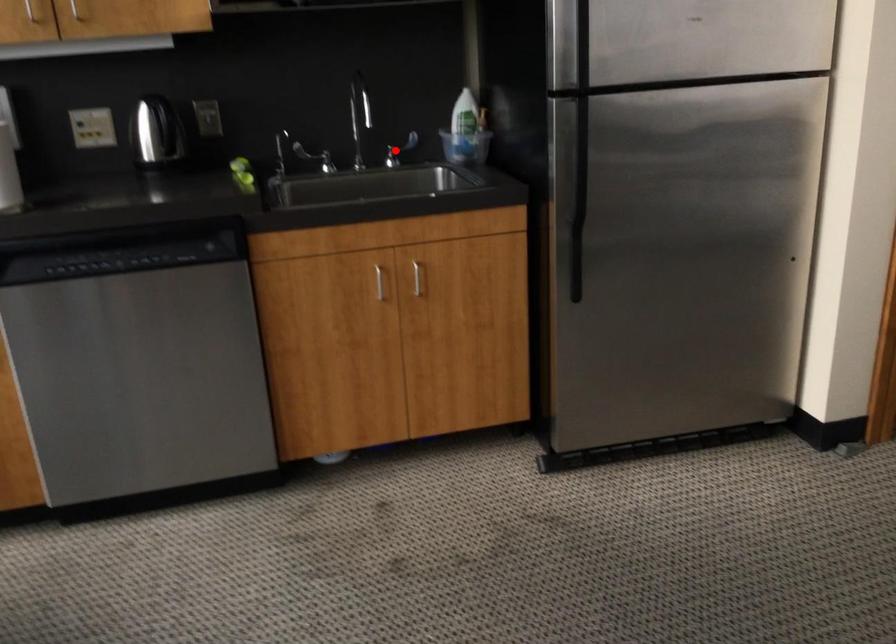
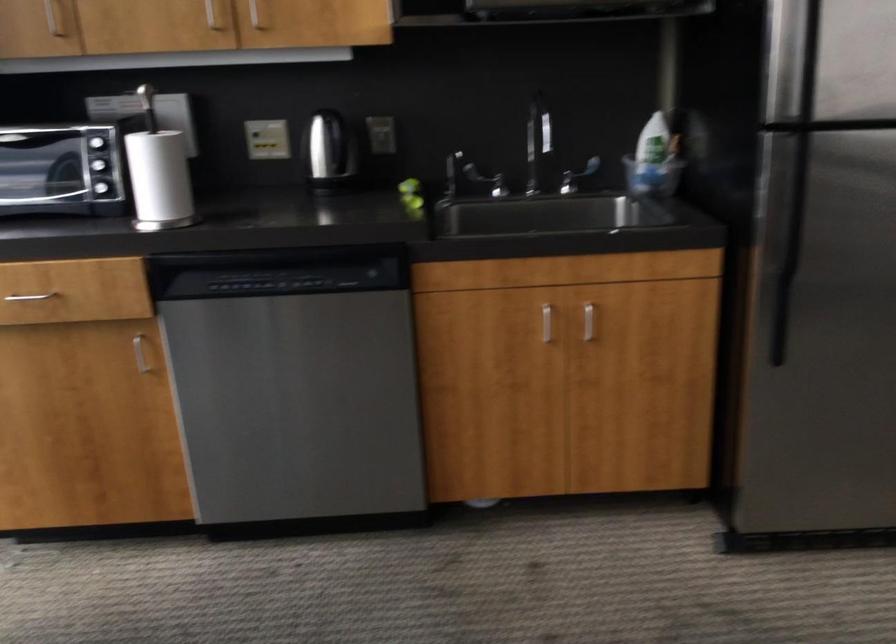
The point at the highlighted location is marked in the first image. Where is the corresponding point in the second image?

(576, 176)